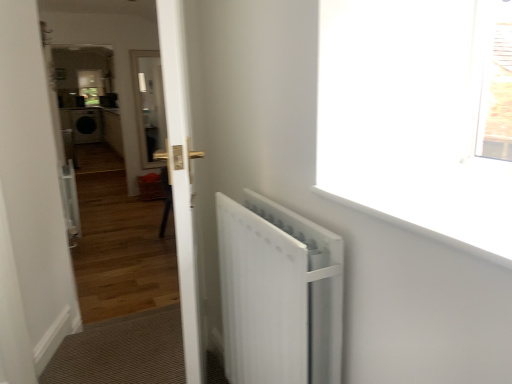
Question: From the image's perspective, is white smooth window sill at upper right below white glossy door at center?

Choices:
 (A) no
 (B) yes

Answer: (A)

Question: Is white smooth window sill at upper right at the left side of white glossy door at center?

Choices:
 (A) yes
 (B) no

Answer: (B)

Question: Can you confirm if white smooth window sill at upper right is bigger than white glossy door at center?

Choices:
 (A) yes
 (B) no

Answer: (B)

Question: Can you confirm if white smooth window sill at upper right is shorter than white glossy door at center?

Choices:
 (A) yes
 (B) no

Answer: (A)

Question: Would you say white glossy door at center is part of white smooth window sill at upper right's contents?

Choices:
 (A) no
 (B) yes

Answer: (A)

Question: Is white matte radiator at right to the left or to the right of white smooth window sill at upper right in the image?

Choices:
 (A) left
 (B) right

Answer: (A)

Question: Is point (332, 364) positioned closer to the camera than point (488, 253)?

Choices:
 (A) closer
 (B) farther

Answer: (B)

Question: Is white matte radiator at right inside or outside of white smooth window sill at upper right?

Choices:
 (A) inside
 (B) outside

Answer: (B)

Question: From the image's perspective, relative to white smooth window sill at upper right, is white matte radiator at right above or below?

Choices:
 (A) above
 (B) below

Answer: (B)

Question: Would you say white glossy door at center is inside or outside white matte radiator at right?

Choices:
 (A) outside
 (B) inside

Answer: (A)

Question: From the image's perspective, is white glossy door at center located above or below white matte radiator at right?

Choices:
 (A) above
 (B) below

Answer: (A)

Question: Is point (97, 192) closer or farther from the camera than point (333, 299)?

Choices:
 (A) farther
 (B) closer

Answer: (A)

Question: Considering their positions, is white glossy door at center located in front of or behind white matte radiator at right?

Choices:
 (A) behind
 (B) front

Answer: (A)

Question: Considering the positions of white matte radiator at right and white glossy door at center in the image, is white matte radiator at right bigger or smaller than white glossy door at center?

Choices:
 (A) big
 (B) small

Answer: (B)

Question: From their relative heights in the image, would you say white matte radiator at right is taller or shorter than white glossy door at center?

Choices:
 (A) tall
 (B) short

Answer: (B)